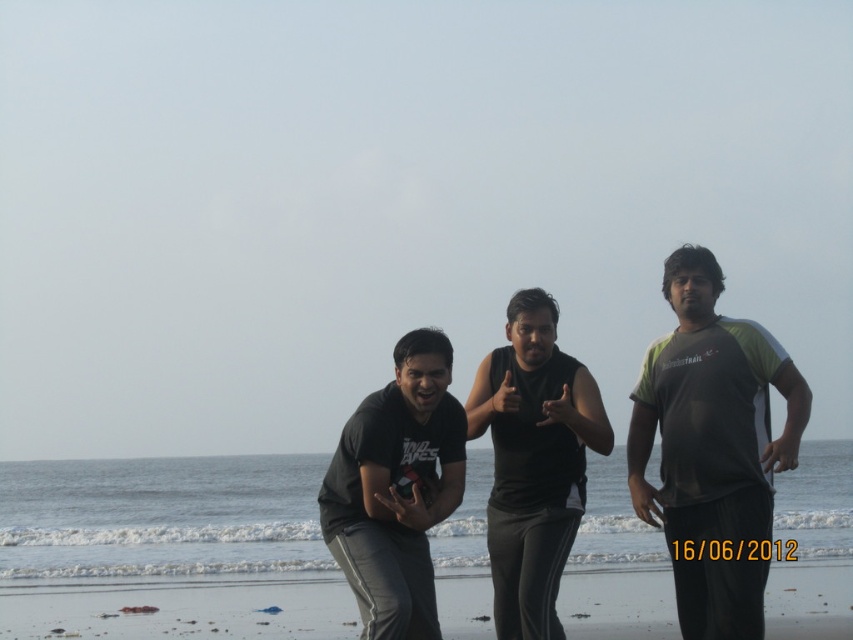
Question: Which point is closer to the camera taking this photo?

Choices:
 (A) (425, 458)
 (B) (651, 408)

Answer: (A)

Question: From the image, what is the correct spatial relationship of smooth sand at lower center in relation to black matte t-shirt at center?

Choices:
 (A) right
 (B) left

Answer: (B)

Question: Based on their relative distances, which object is farther from the black matte t-shirt at center?

Choices:
 (A) green and gray t-shirt at right
 (B) smooth sand at lower center

Answer: (B)

Question: Can you confirm if green and gray t-shirt at right is positioned to the right of black matte t-shirt at center?

Choices:
 (A) no
 (B) yes

Answer: (B)

Question: Which point is farther from the camera taking this photo?

Choices:
 (A) [62, 604]
 (B) [688, 328]
 (C) [422, 353]
 (D) [476, 378]

Answer: (A)

Question: Observing the image, what is the correct spatial positioning of smooth sand at lower center in reference to black matte tank top at center?

Choices:
 (A) above
 (B) below

Answer: (B)